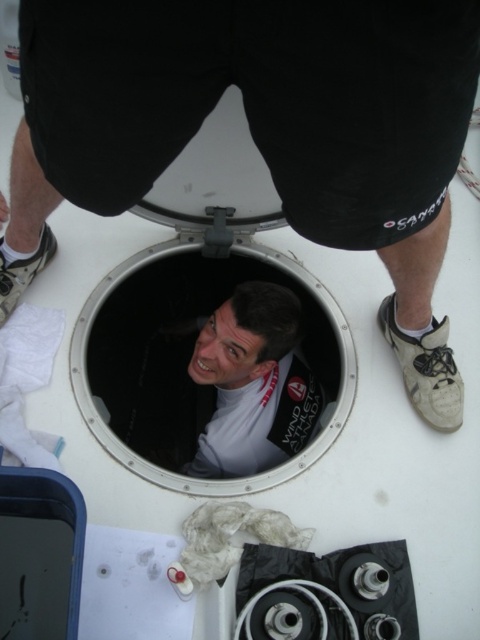
Question: Is white metallic porthole at center thinner than white matte shirt at center?

Choices:
 (A) no
 (B) yes

Answer: (A)

Question: Which object appears farthest from the camera in this image?

Choices:
 (A) white matte face at center
 (B) white matte shirt at center

Answer: (B)

Question: Which is nearer to the white metallic porthole at center?

Choices:
 (A) white matte shirt at center
 (B) white matte face at center

Answer: (A)

Question: Does white matte face at center appear under white matte shirt at center?

Choices:
 (A) no
 (B) yes

Answer: (A)

Question: Is white matte face at center positioned in front of white metallic porthole at center?

Choices:
 (A) yes
 (B) no

Answer: (A)

Question: Among these points, which one is farthest from the camera?

Choices:
 (A) (249, 353)
 (B) (164, 476)

Answer: (A)